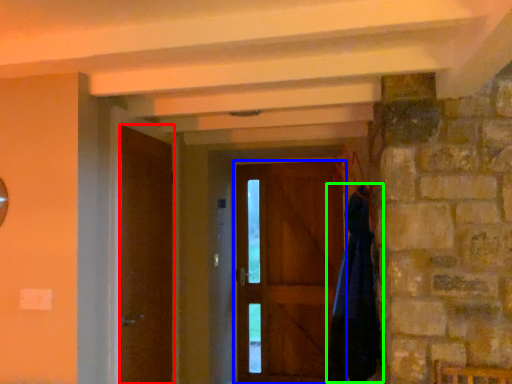
Question: Which object is the closest to the door (highlighted by a red box)? Choose among these: door (highlighted by a blue box) or cloak (highlighted by a green box).

Choices:
 (A) door
 (B) cloak

Answer: (B)